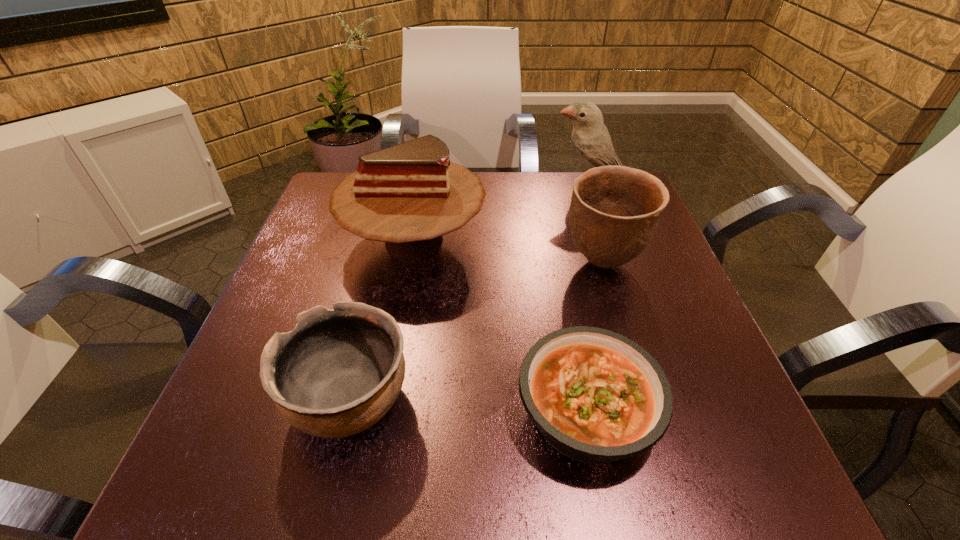
This screenshot has height=540, width=960. Identify the location of free space located 0.120m on the front of the cake. (397, 337).

Locate an element on the screen. free space located 0.080m on the left of the taller pottery is located at coordinates (525, 264).

Locate an element on the screen. The image size is (960, 540). free space located on the back of the nearer pottery is located at coordinates (391, 234).

Find the location of `vacant space located 0.280m on the back of the shortest object`. vacant space located 0.280m on the back of the shortest object is located at coordinates (555, 252).

Identify the location of bird that is at the far edge. (591, 141).

Locate an element on the screen. cake at the far edge is located at coordinates (408, 195).

Locate an element on the screen. The width and height of the screenshot is (960, 540). pottery that is at the near edge is located at coordinates (339, 371).

This screenshot has height=540, width=960. I want to click on stew that is positioned at the near edge, so click(596, 396).

This screenshot has width=960, height=540. I want to click on cake that is at the left edge, so click(408, 195).

At what (x,y) coordinates should I click in order to perform the action: click on pottery located in the left edge section of the desktop. Please return your answer as a coordinate pair (x, y). Looking at the image, I should click on (339, 371).